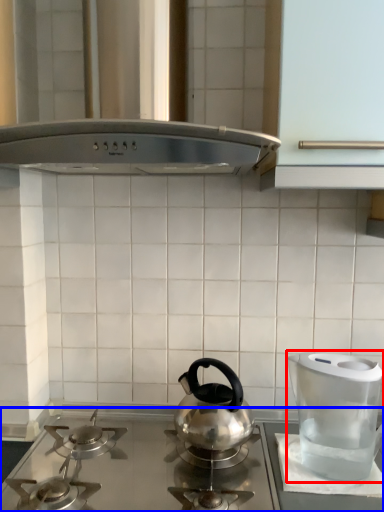
Question: Which object is further to the camera taking this photo, kitchen appliance (highlighted by a red box) or gas stove (highlighted by a blue box)?

Choices:
 (A) kitchen appliance
 (B) gas stove

Answer: (A)